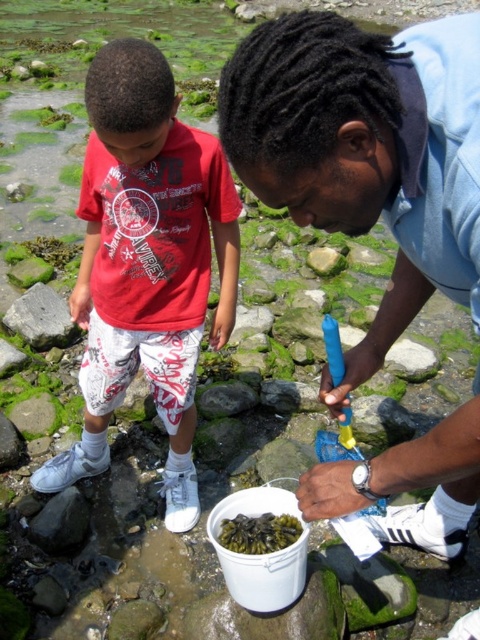
Question: Is matte red t-shirt at left positioned at the back of green seaweed at lower center?

Choices:
 (A) no
 (B) yes

Answer: (A)

Question: Does blue plastic bucket at center appear on the left side of matte red t-shirt at left?

Choices:
 (A) no
 (B) yes

Answer: (A)

Question: Which of the following is the closest to the observer?

Choices:
 (A) green seaweed at lower center
 (B) matte red t-shirt at left
 (C) gray rock at left
 (D) blue plastic bucket at center

Answer: (D)

Question: Is matte red t-shirt at left thinner than green seaweed at lower center?

Choices:
 (A) yes
 (B) no

Answer: (B)

Question: Which point is closer to the camera?

Choices:
 (A) green seaweed at lower center
 (B) blue plastic bucket at center
 (C) matte red t-shirt at left
 (D) gray rock at left

Answer: (B)

Question: Which point is closer to the camera taking this photo?

Choices:
 (A) [x=137, y=269]
 (B) [x=442, y=532]
 (C) [x=260, y=548]
 (D) [x=20, y=336]

Answer: (C)